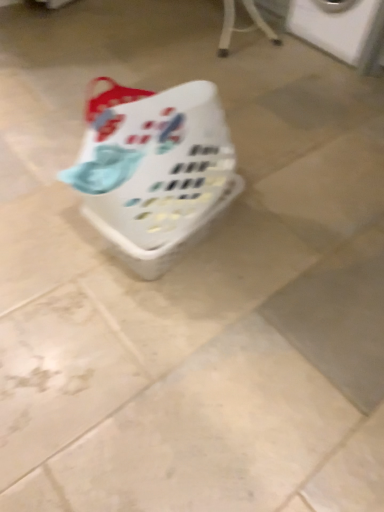
This screenshot has width=384, height=512. Describe the element at coordinates (341, 28) in the screenshot. I see `white plastic washing machine at upper right` at that location.

This screenshot has height=512, width=384. Identify the location of white plastic washing machine at upper right. (341, 28).

The height and width of the screenshot is (512, 384). What do you see at coordinates (155, 170) in the screenshot? I see `white plastic basket at center` at bounding box center [155, 170].

Image resolution: width=384 pixels, height=512 pixels. In order to click on white plastic basket at center in this screenshot , I will do `click(155, 170)`.

Identify the location of white plastic washing machine at upper right. The width and height of the screenshot is (384, 512). (341, 28).

Is white plastic basket at center at the left side of white plastic washing machine at upper right?

Correct, you'll find white plastic basket at center to the left of white plastic washing machine at upper right.

Is white plastic basket at center in front of or behind white plastic washing machine at upper right in the image?

In the image, white plastic basket at center appears in front of white plastic washing machine at upper right.

Which is in front, point (122, 259) or point (342, 19)?

Point (122, 259)

From the image's perspective, which is below, white plastic basket at center or white plastic washing machine at upper right?

white plastic basket at center, from the image's perspective.

From the picture: From a real-world perspective, which object rests below the other?

From a 3D spatial view, white plastic basket at center is below.

Considering the relative sizes of white plastic basket at center and white plastic washing machine at upper right in the image provided, is white plastic basket at center thinner than white plastic washing machine at upper right?

Correct, the width of white plastic basket at center is less than that of white plastic washing machine at upper right.

Who is shorter, white plastic basket at center or white plastic washing machine at upper right?

With less height is white plastic basket at center.

Is white plastic basket at center bigger than white plastic washing machine at upper right?

No.

Would you say white plastic basket at center contains white plastic washing machine at upper right?

No, white plastic washing machine at upper right is located outside of white plastic basket at center.

Is white plastic basket at center directly adjacent to white plastic washing machine at upper right?

No, white plastic basket at center is not in contact with white plastic washing machine at upper right.

Is white plastic basket at center looking in the opposite direction of white plastic washing machine at upper right?

No, white plastic basket at center's orientation is not away from white plastic washing machine at upper right.

How many degrees apart are the facing directions of white plastic basket at center and white plastic washing machine at upper right?

white plastic basket at center and white plastic washing machine at upper right are facing 97.6 degrees away from each other.

Find the location of a particular element. washing machine on the right of white plastic basket at center is located at coordinates (341, 28).

Is white plastic washing machine at upper right to the left of white plastic basket at center from the viewer's perspective?

In fact, white plastic washing machine at upper right is to the right of white plastic basket at center.

Is white plastic washing machine at upper right further to camera compared to white plastic basket at center?

Yes, white plastic washing machine at upper right is further from the camera.

Does point (347, 28) lie behind point (85, 152)?

Yes, point (347, 28) is farther from viewer.

From the image's perspective, is white plastic washing machine at upper right located above white plastic basket at center?

Yes, from the image's perspective, white plastic washing machine at upper right is above white plastic basket at center.

From a real-world perspective, between white plastic washing machine at upper right and white plastic basket at center, who is vertically lower?

white plastic basket at center is physically lower.

Is white plastic washing machine at upper right wider or thinner than white plastic basket at center?

Considering their sizes, white plastic washing machine at upper right looks broader than white plastic basket at center.

Which of these two, white plastic washing machine at upper right or white plastic basket at center, stands taller?

white plastic washing machine at upper right is taller.

Which of these two, white plastic washing machine at upper right or white plastic basket at center, is bigger?

With larger size is white plastic washing machine at upper right.

Is white plastic washing machine at upper right situated inside white plastic basket at center or outside?

white plastic washing machine at upper right cannot be found inside white plastic basket at center.

Is white plastic washing machine at upper right placed right next to white plastic basket at center?

No, white plastic washing machine at upper right is not beside white plastic basket at center.

Could you tell me if white plastic washing machine at upper right is facing white plastic basket at center?

Yes, white plastic washing machine at upper right is aimed at white plastic basket at center.

Can you tell me how much white plastic washing machine at upper right and white plastic basket at center differ in facing direction?

97.6 degrees.

The height and width of the screenshot is (512, 384). What are the coordinates of `basket below the white plastic washing machine at upper right (from the image's perspective)` in the screenshot? It's located at (155, 170).

Where is `washing machine behind the white plastic basket at center`? This screenshot has height=512, width=384. washing machine behind the white plastic basket at center is located at coordinates (341, 28).

This screenshot has height=512, width=384. What are the coordinates of `washing machine that is above the white plastic basket at center (from the image's perspective)` in the screenshot? It's located at (341, 28).